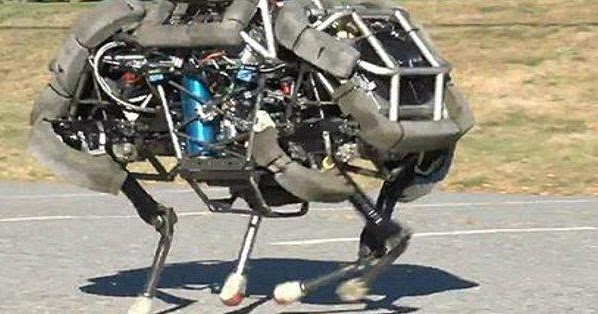
This screenshot has width=598, height=314. Find the location of `padding`. padding is located at coordinates (423, 133), (206, 39), (65, 63).